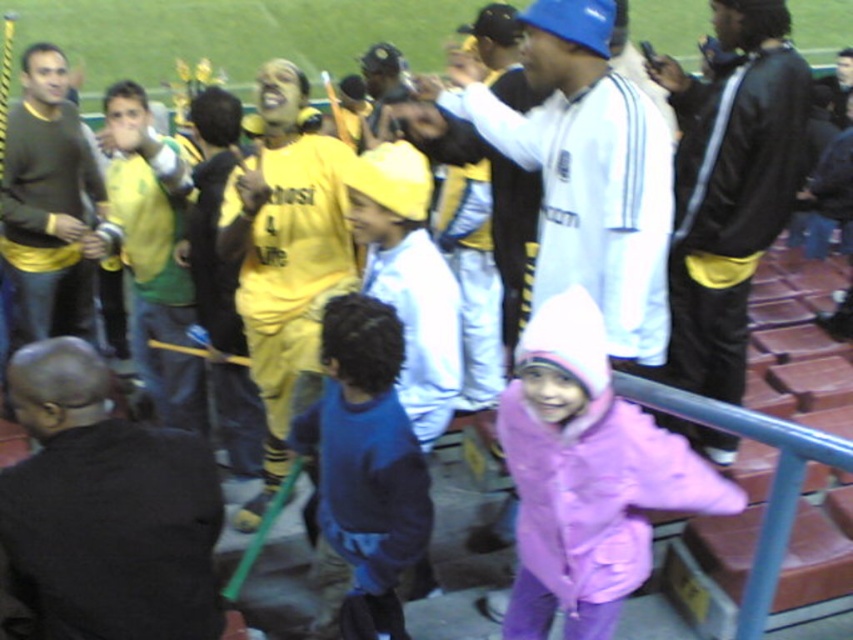
Is blue fleece jacket at center positioned at the back of matte green jersey at center?

No, it is in front of matte green jersey at center.

Does point (323, 538) lie behind point (148, 113)?

No.

Does point (370, 579) come in front of point (149, 355)?

Yes, point (370, 579) is closer to viewer.

Identify the location of blue fleece jacket at center. The height and width of the screenshot is (640, 853). (364, 449).

Does black matte jacket at lower left come behind yellow jersey at center?

No, it is not.

Between point (39, 458) and point (276, 234), which one is positioned behind?

Positioned behind is point (276, 234).

The image size is (853, 640). I want to click on black matte jacket at lower left, so click(x=106, y=508).

This screenshot has height=640, width=853. What are the coordinates of `black matte jacket at lower left` in the screenshot? It's located at (106, 508).

Is the position of black matte jacket at lower left less distant than that of light blue hoodie at center?

Yes, black matte jacket at lower left is in front of light blue hoodie at center.

What are the coordinates of `black matte jacket at lower left` in the screenshot? It's located at (106, 508).